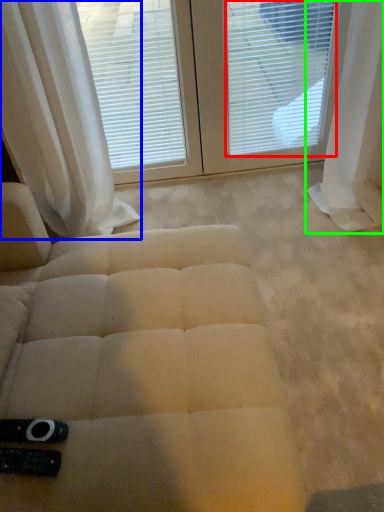
Question: Which is farther away from blind (highlighted by a red box)? curtain (highlighted by a blue box) or curtain (highlighted by a green box)?

Choices:
 (A) curtain
 (B) curtain

Answer: (A)